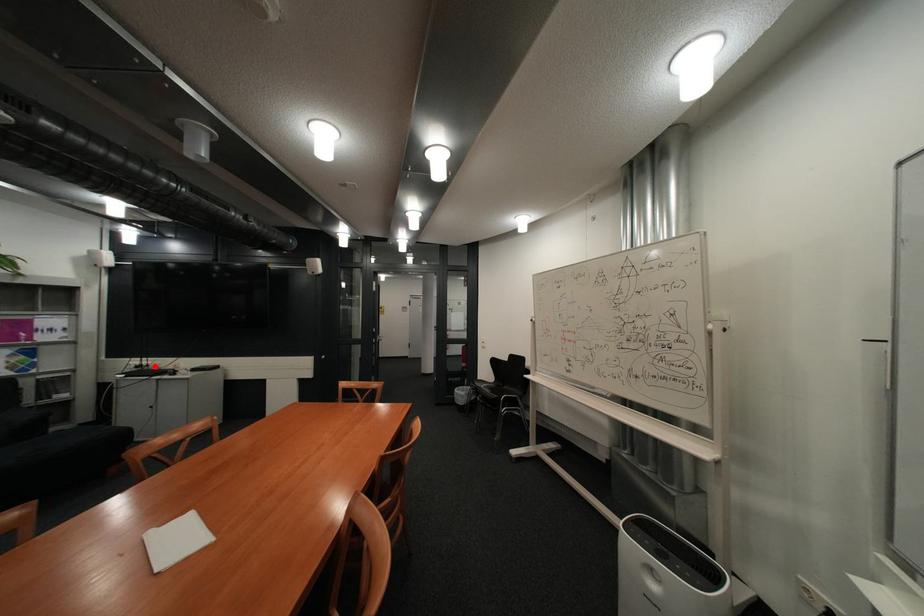
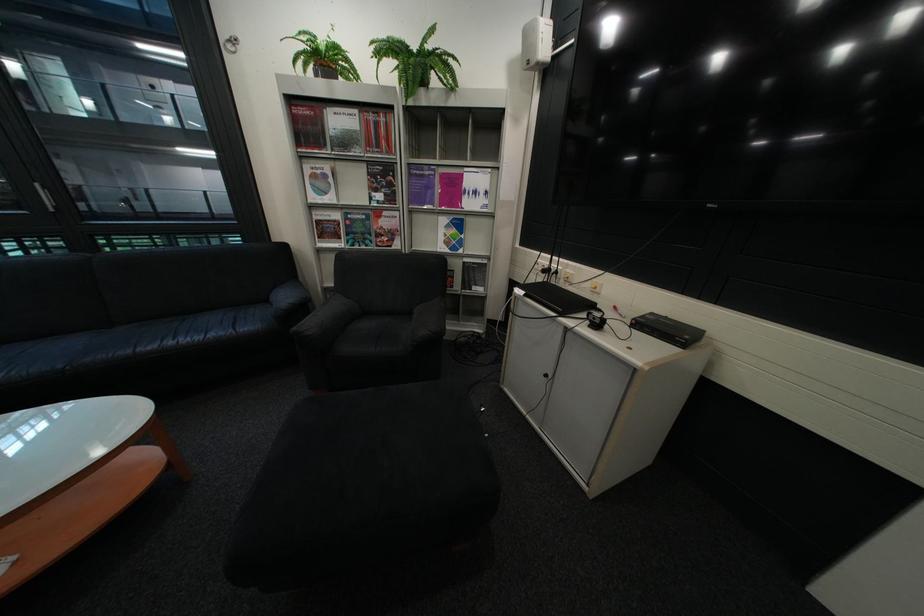
In the second image, find the point that corresponds to the highlighted location in the first image.

(563, 270)